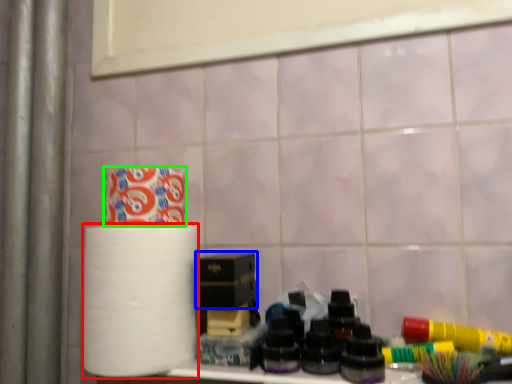
Question: Which object is the farthest from paper towel (highlighted by a red box)? Choose among these: box (highlighted by a blue box) or toilet paper (highlighted by a green box).

Choices:
 (A) box
 (B) toilet paper

Answer: (B)